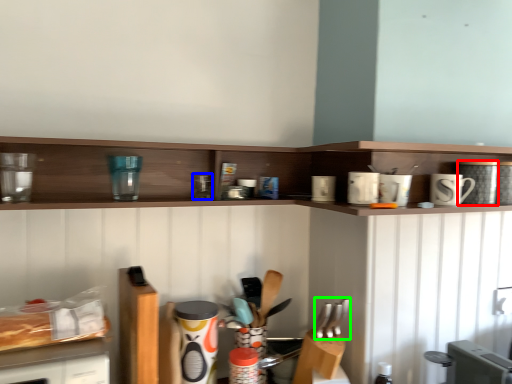
Question: Which object is the closest to the appliance (highlighted by a red box)? Choose among these: appliance (highlighted by a blue box) or silverware (highlighted by a green box).

Choices:
 (A) appliance
 (B) silverware

Answer: (B)